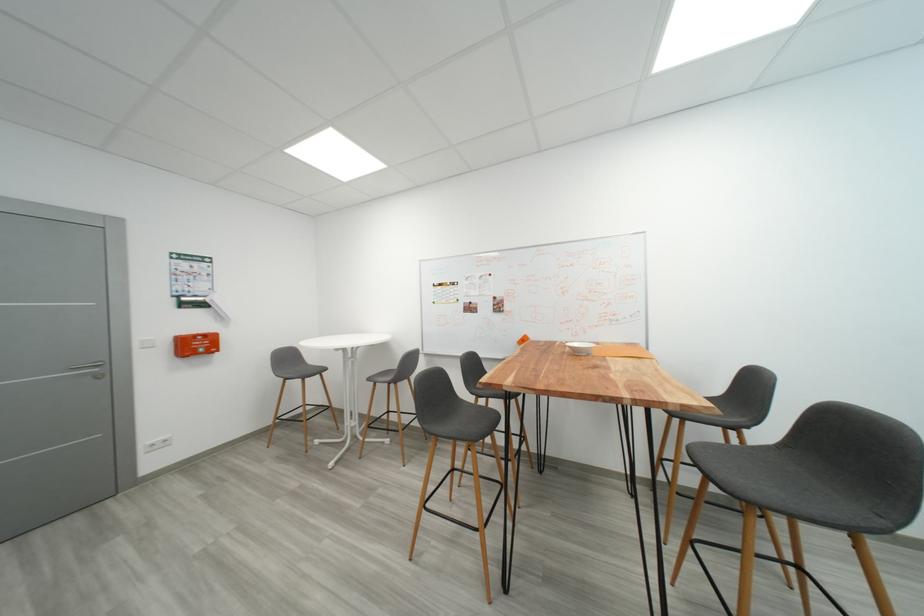
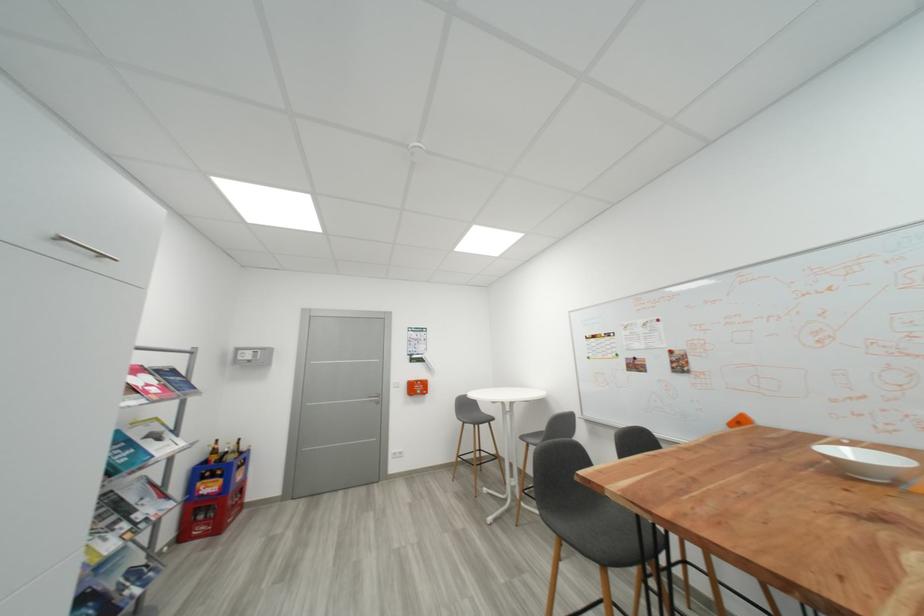
Locate, in the second image, the point that corresponds to point 286,461 in the first image.

(465, 496)